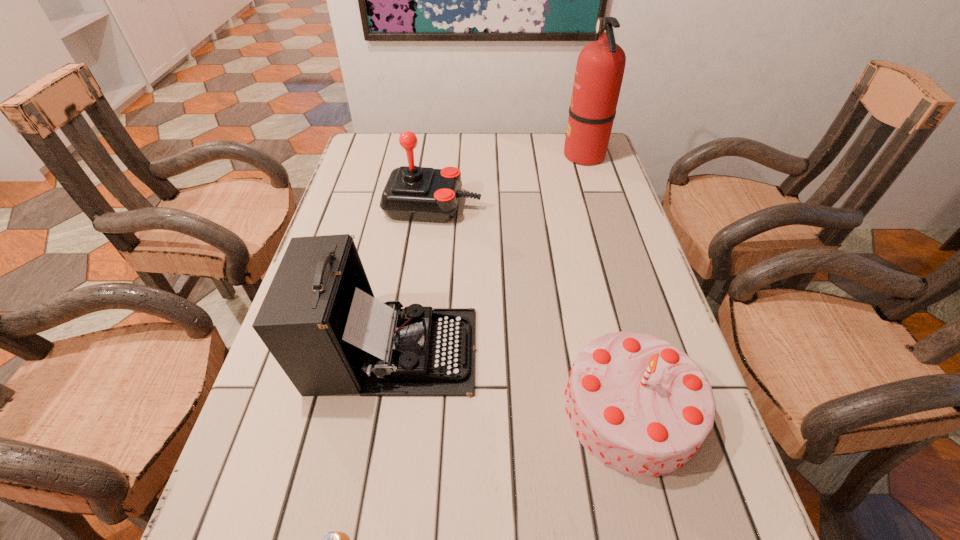
Locate an element on the screen. The height and width of the screenshot is (540, 960). vacant space that satisfies the following two spatial constraints: 1. inside the open case of the birthday cake; 2. on the right side of the typewriter is located at coordinates [x=382, y=410].

I want to click on vacant space that satisfies the following two spatial constraints: 1. inside the open case of the typewriter; 2. on the right side of the second shortest object, so click(x=382, y=410).

What are the coordinates of `vacant space that satisfies the following two spatial constraints: 1. on the front side of the second farthest object; 2. on the left side of the second shortest object` in the screenshot? It's located at coord(408,410).

At what (x,y) coordinates should I click in order to perform the action: click on vacant space that satisfies the following two spatial constraints: 1. on the back side of the second shortest object; 2. inside the open case of the typewriter. Please return your answer as a coordinate pair (x, y). Looking at the image, I should click on [x=616, y=350].